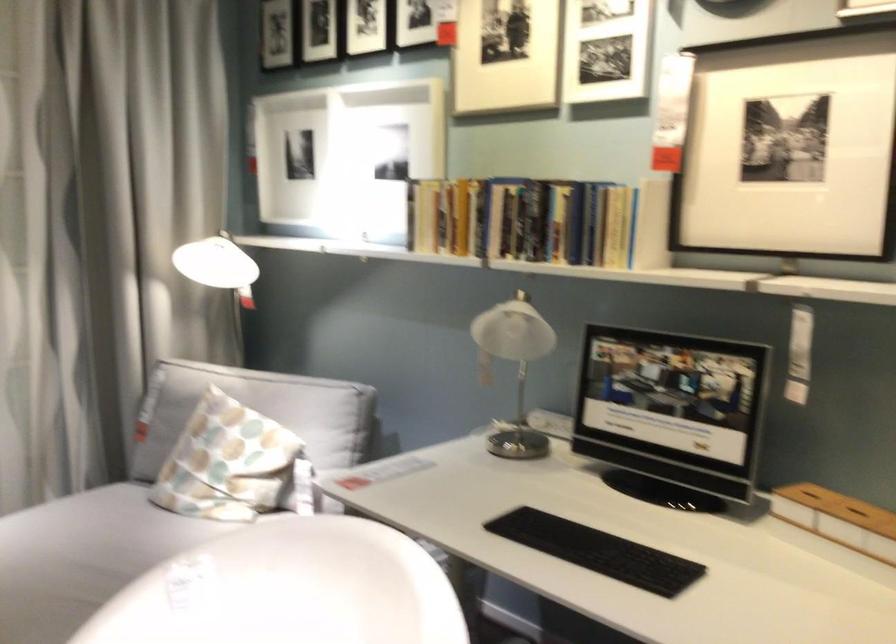
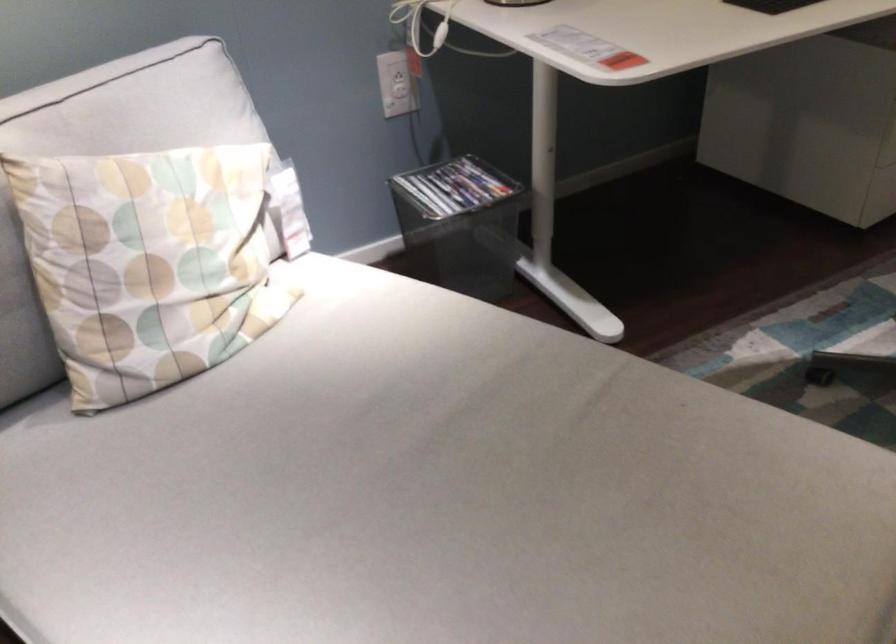
The point at (x=211, y=448) is marked in the first image. Where is the corresponding point in the second image?

(149, 263)